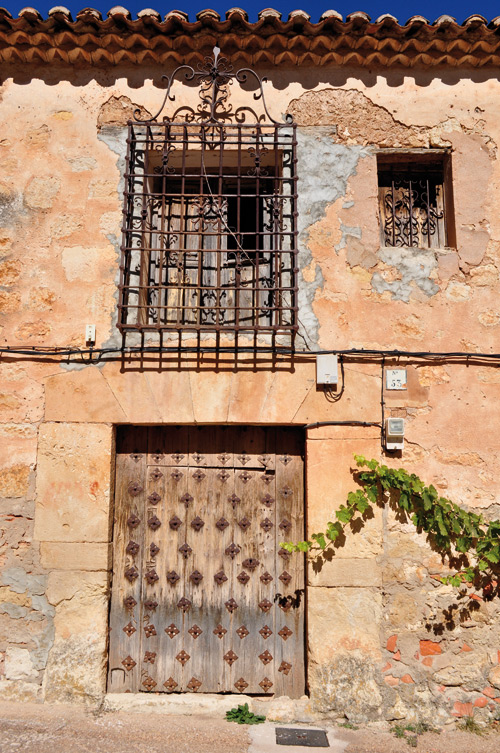
Locate an element on the screen. The width and height of the screenshot is (500, 753). large wooden door is located at coordinates (141, 467), (144, 653), (272, 663), (284, 456).